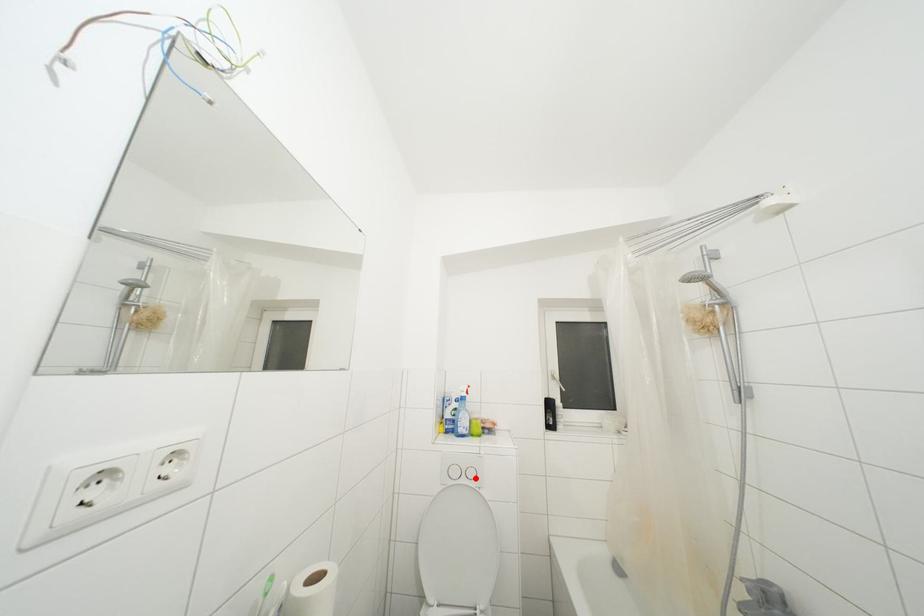
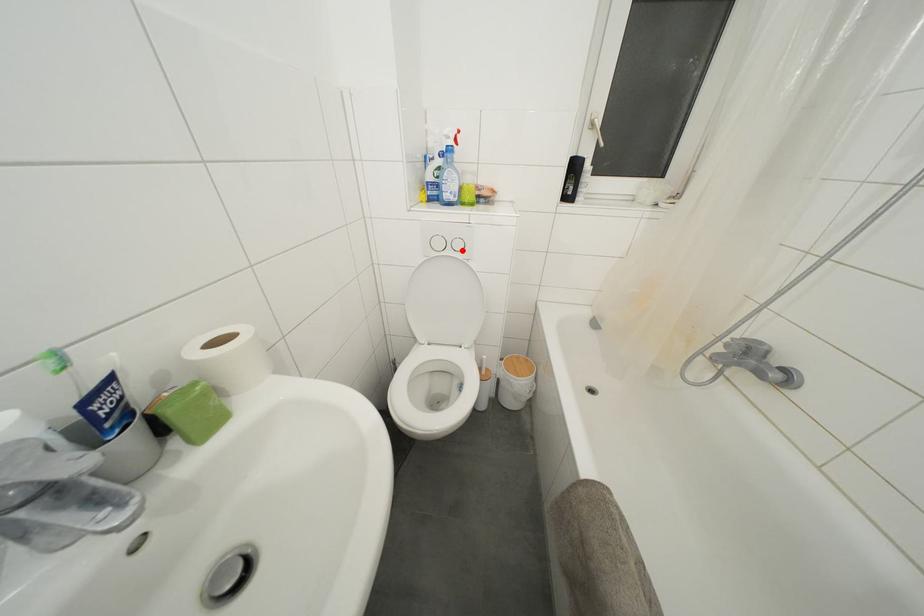
I am providing you with two images of the same scene from different viewpoints. A red point is marked on the first image and another point is marked on the second image. Is the marked point in image1 the same physical position as the marked point in image2?

Yes